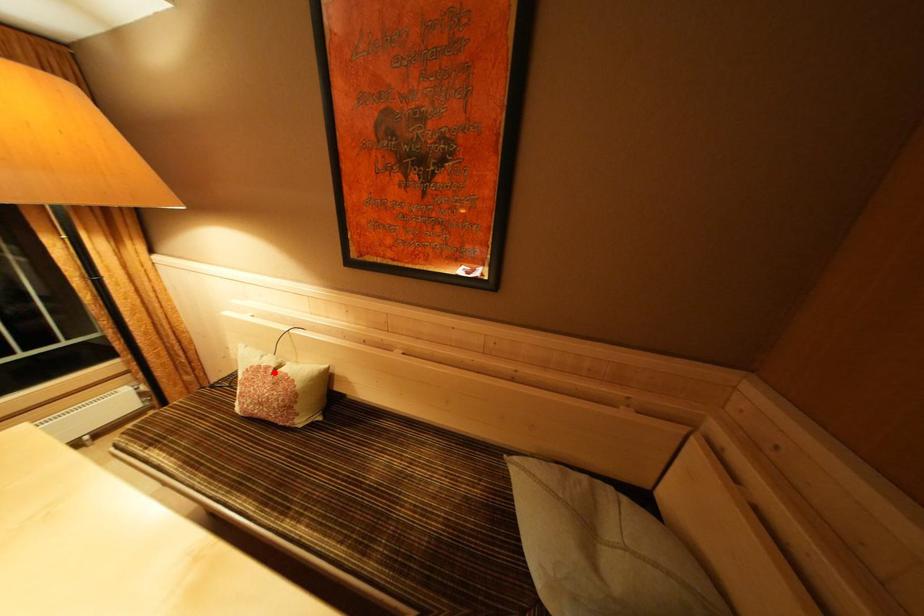
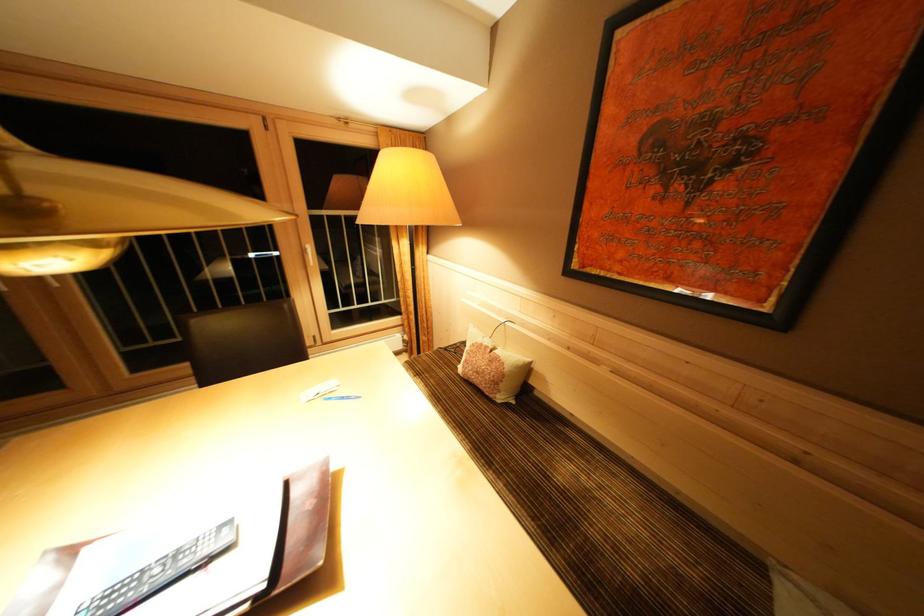
The point at the highlighted location is marked in the first image. Where is the corresponding point in the second image?

(493, 352)